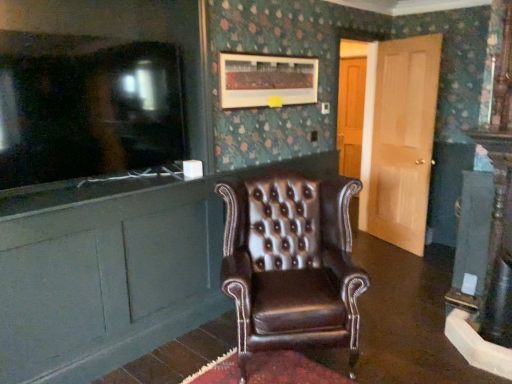
Describe the element at coordinates (291, 264) in the screenshot. The height and width of the screenshot is (384, 512). I see `brown leather wingback chair at center` at that location.

What do you see at coordinates (399, 139) in the screenshot?
I see `light brown wood door at right` at bounding box center [399, 139].

Find the location of a particular element. This screenshot has width=512, height=384. matte black television at left is located at coordinates (86, 107).

Locate an element on the screen. The width and height of the screenshot is (512, 384). brown leather cabinet at left is located at coordinates [111, 270].

Would you consider light brown wood door at right to be distant from matte black television at left?

light brown wood door at right is positioned a significant distance from matte black television at left.

Based on the photo, which is less distant, (404, 117) or (81, 113)?

Point (404, 117).

Does light brown wood door at right lie in front of matte black television at left?

No, light brown wood door at right is further to the viewer.

Can we say light brown wood door at right lies outside matte black television at left?

Yes, light brown wood door at right is not within matte black television at left.

Choose the correct answer: Is wooden picture frame at upper center inside brown leather wingback chair at center or outside it?

wooden picture frame at upper center is spatially situated outside brown leather wingback chair at center.

From a real-world perspective, is wooden picture frame at upper center over brown leather wingback chair at center?

Yes, from a real-world perspective, wooden picture frame at upper center is over brown leather wingback chair at center

From the image's perspective, is wooden picture frame at upper center below brown leather wingback chair at center?

No.

Would you say wooden picture frame at upper center is a long distance from brown leather wingback chair at center?

Indeed, wooden picture frame at upper center is not near brown leather wingback chair at center.

Identify the location of door behind the brown leather cabinet at left. (399, 139).

From a real-world perspective, is light brown wood door at right over brown leather cabinet at left?

Yes, from a real-world perspective, light brown wood door at right is above brown leather cabinet at left.

In the scene shown: Is light brown wood door at right oriented towards brown leather cabinet at left?

Yes, light brown wood door at right is turned towards brown leather cabinet at left.

Which is less distant, (376, 152) or (350, 295)?

Positioned in front is point (350, 295).

Considering the relative sizes of light brown wood door at right and brown leather wingback chair at center in the image provided, is light brown wood door at right taller than brown leather wingback chair at center?

Correct, light brown wood door at right is much taller as brown leather wingback chair at center.

Is light brown wood door at right aimed at brown leather wingback chair at center?

No, light brown wood door at right is not facing towards brown leather wingback chair at center.

At what (x,y) coordinates should I click in order to perform the action: click on chair in front of the light brown wood door at right. Please return your answer as a coordinate pair (x, y). This screenshot has width=512, height=384. Looking at the image, I should click on (291, 264).

From a real-world perspective, between wooden picture frame at upper center and matte black television at left, who is vertically lower?

From a 3D spatial view, matte black television at left is below.

Could matte black television at left be considered to be inside wooden picture frame at upper center?

No, matte black television at left is not inside wooden picture frame at upper center.

Which object is positioned more to the right, wooden picture frame at upper center or matte black television at left?

Positioned to the right is wooden picture frame at upper center.

Can you tell me how much wooden picture frame at upper center and matte black television at left differ in facing direction?

There is a 1.12-degree angle between the facing directions of wooden picture frame at upper center and matte black television at left.

Are brown leather cabinet at left and matte black television at left far apart?

brown leather cabinet at left is near matte black television at left, not far away.

Is brown leather cabinet at left positioned with its back to matte black television at left?

No, brown leather cabinet at left is not facing the opposite direction of matte black television at left.

From a real-world perspective, is brown leather cabinet at left beneath matte black television at left?

Yes, from a real-world perspective, brown leather cabinet at left is under matte black television at left.

Image resolution: width=512 pixels, height=384 pixels. There is a brown leather cabinet at left. In order to click on tv show above it (from a real-world perspective) in this screenshot , I will do `click(86, 107)`.

Find the location of `door above the brown leather wingback chair at center (from the image's perspective)`. door above the brown leather wingback chair at center (from the image's perspective) is located at coordinates (399, 139).

From a real-world perspective, who is located higher, brown leather wingback chair at center or light brown wood door at right?

In real-world perspective, light brown wood door at right is above.

Would you say brown leather wingback chair at center is outside light brown wood door at right?

Yes, brown leather wingback chair at center is not within light brown wood door at right.

What's the angular difference between brown leather wingback chair at center and light brown wood door at right's facing directions?

The angular difference between brown leather wingback chair at center and light brown wood door at right is 69.6 degrees.

Locate an element on the screen. The width and height of the screenshot is (512, 384). door on the right of the matte black television at left is located at coordinates (399, 139).

Image resolution: width=512 pixels, height=384 pixels. Find the location of `chair beneath the wooden picture frame at upper center (from a real-world perspective)`. chair beneath the wooden picture frame at upper center (from a real-world perspective) is located at coordinates (291, 264).

Considering their positions, is light brown wood door at right positioned closer to wooden picture frame at upper center than brown leather cabinet at left?

Based on the image, brown leather cabinet at left appears to be nearer to wooden picture frame at upper center.

When comparing their distances from wooden picture frame at upper center, does brown leather cabinet at left or light brown wood door at right seem further?

Based on the image, light brown wood door at right appears to be further to wooden picture frame at upper center.

Estimate the real-world distances between objects in this image. Which object is further from brown leather cabinet at left, wooden picture frame at upper center or light brown wood door at right?

light brown wood door at right is further to brown leather cabinet at left.

Which object lies further to the anchor point brown leather cabinet at left, brown leather wingback chair at center or matte black television at left?

Among the two, brown leather wingback chair at center is located further to brown leather cabinet at left.

From the image, which object appears to be nearer to brown leather cabinet at left, matte black television at left or light brown wood door at right?

Among the two, matte black television at left is located nearer to brown leather cabinet at left.

When comparing their distances from matte black television at left, does brown leather cabinet at left or light brown wood door at right seem further?

Among the two, light brown wood door at right is located further to matte black television at left.

From the image, which object appears to be farther from light brown wood door at right, matte black television at left or wooden picture frame at upper center?

matte black television at left is positioned further to the anchor light brown wood door at right.

Looking at the image, which one is located further to matte black television at left, light brown wood door at right or brown leather wingback chair at center?

light brown wood door at right lies further to matte black television at left than the other object.

You are a GUI agent. You are given a task and a screenshot of the screen. Output one action in this format:
    pyautogui.click(x=<x>, y=<y>)
    Task: Click on the cabinetry between wooden picture frame at upper center and brown leather wingback chair at center in the up-down direction
    This screenshot has height=384, width=512.
    Given the screenshot: What is the action you would take?
    pyautogui.click(x=111, y=270)

The image size is (512, 384). Find the location of `cabinetry between matte black television at left and light brown wood door at right`. cabinetry between matte black television at left and light brown wood door at right is located at coordinates (111, 270).

Find the location of a particular element. Image resolution: width=512 pixels, height=384 pixels. tv show that lies between wooden picture frame at upper center and brown leather cabinet at left from top to bottom is located at coordinates (86, 107).

Where is `chair between brown leather cabinet at left and light brown wood door at right from front to back`? The image size is (512, 384). chair between brown leather cabinet at left and light brown wood door at right from front to back is located at coordinates [x=291, y=264].